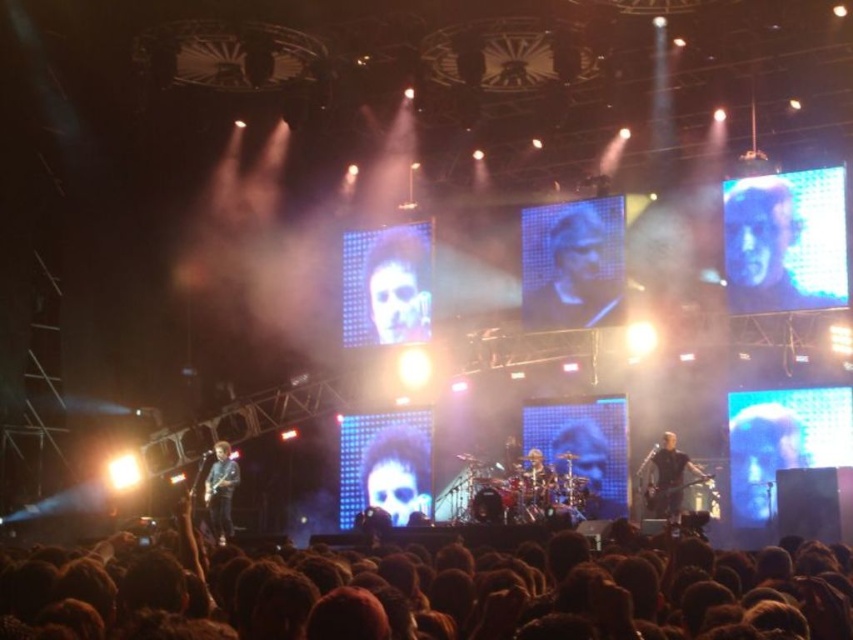
Question: Is blue matte face at center to the right of black leather jacket at center from the viewer's perspective?

Choices:
 (A) no
 (B) yes

Answer: (B)

Question: Which object is positioned farthest from the blue matte face at center?

Choices:
 (A) black leather jacket at center
 (B) blue denim jacket at lower left
 (C) brown hair at lower center

Answer: (B)

Question: Which of the following is the farthest from the observer?

Choices:
 (A) (756, 522)
 (B) (628, 550)

Answer: (A)

Question: Does smooth black face at center have a larger size compared to smooth skin face at center?

Choices:
 (A) yes
 (B) no

Answer: (A)

Question: Among these points, which one is farthest from the camera?

Choices:
 (A) (424, 305)
 (B) (674, 460)
 (C) (589, 612)
 (D) (729, 445)

Answer: (A)

Question: Is smooth black face at center bigger than blue denim jacket at lower left?

Choices:
 (A) no
 (B) yes

Answer: (B)